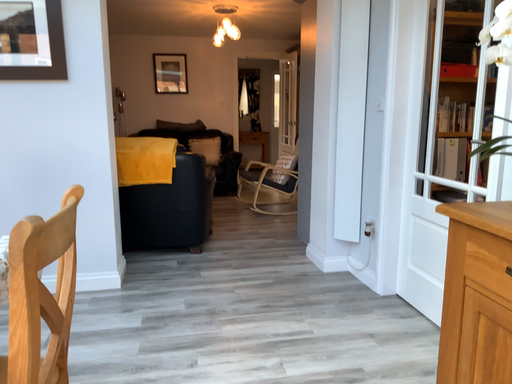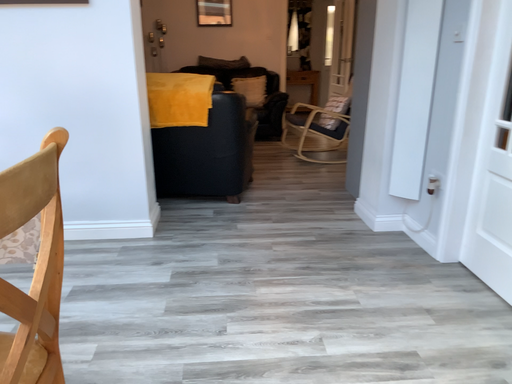
Question: How did the camera likely rotate when shooting the video?

Choices:
 (A) rotated upward
 (B) rotated downward

Answer: (B)